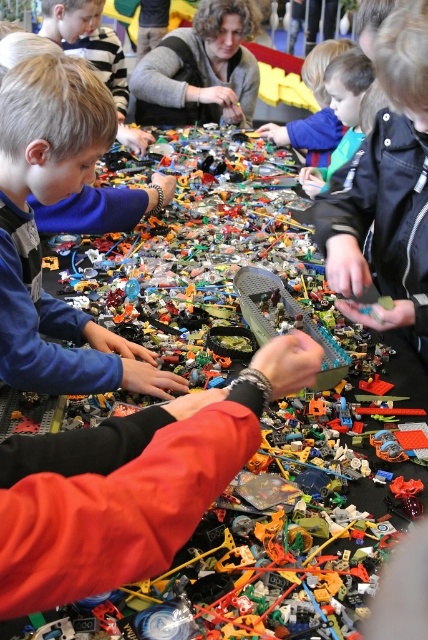
Question: Is green matte toy car at center to the right of matte gray sweater at upper center from the viewer's perspective?

Choices:
 (A) yes
 (B) no

Answer: (A)

Question: Among these objects, which one is nearest to the camera?

Choices:
 (A) green matte toy car at center
 (B) matte gray sweater at upper center
 (C) blue matte shirt at left
 (D) matte black arm at center

Answer: (D)

Question: Is matte black arm at center to the right of blue matte shirt at left from the viewer's perspective?

Choices:
 (A) yes
 (B) no

Answer: (A)

Question: Which point is closer to the camera taking this photo?

Choices:
 (A) pos(107,336)
 (B) pos(202,83)

Answer: (A)

Question: Which of the following is the farthest from the observer?

Choices:
 (A) matte black arm at center
 (B) blue matte shirt at left

Answer: (B)

Question: Considering the relative positions of blue matte shirt at left and green matte toy car at center in the image provided, where is blue matte shirt at left located with respect to green matte toy car at center?

Choices:
 (A) below
 (B) above

Answer: (A)